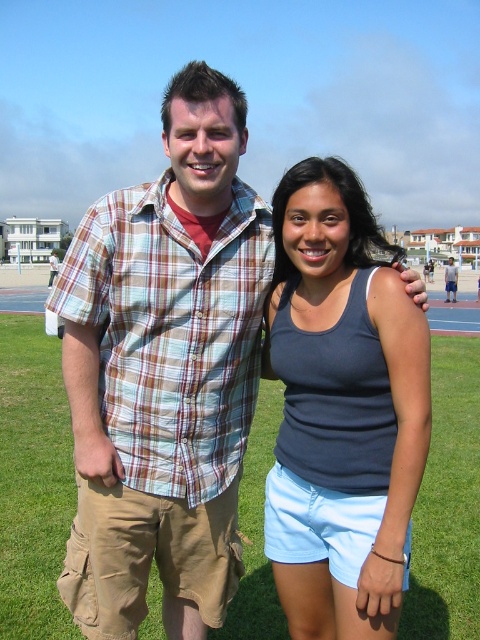
Question: Which object is positioned farthest from the plaid shirt at center?

Choices:
 (A) matte plaid shirt at center
 (B) green grass at center
 (C) matte blue tank top at center

Answer: (C)

Question: Observing the image, what is the correct spatial positioning of plaid cotton shirt at center in reference to matte plaid shirt at center?

Choices:
 (A) right
 (B) left

Answer: (B)

Question: Can you confirm if plaid cotton shirt at center is positioned above plaid shirt at center?

Choices:
 (A) yes
 (B) no

Answer: (B)

Question: Can you confirm if plaid cotton shirt at center is thinner than plaid shirt at center?

Choices:
 (A) yes
 (B) no

Answer: (A)

Question: Which point appears farthest from the camera in this image?

Choices:
 (A) (444, 346)
 (B) (447, 278)
 (C) (423, 275)

Answer: (C)

Question: Which object is the farthest from the matte plaid shirt at center?

Choices:
 (A) plaid cotton shirt at center
 (B) green grass at center
 (C) plaid shirt at center

Answer: (A)